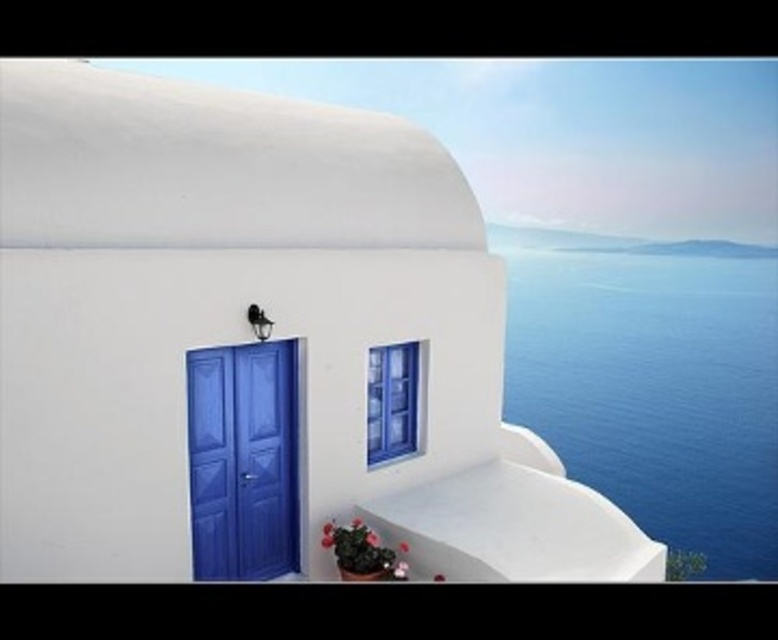
Question: Which object is positioned closest to the blue glass window at center?

Choices:
 (A) blue water at right
 (B) matte blue door at lower left

Answer: (B)

Question: Is blue water at right below blue glass window at center?

Choices:
 (A) no
 (B) yes

Answer: (B)

Question: Can you confirm if blue water at right is positioned to the right of blue glass window at center?

Choices:
 (A) no
 (B) yes

Answer: (B)

Question: Is blue water at right thinner than blue glass window at center?

Choices:
 (A) yes
 (B) no

Answer: (B)

Question: Which of the following is the closest to the observer?

Choices:
 (A) blue water at right
 (B) blue glass window at center

Answer: (B)

Question: Among these objects, which one is nearest to the camera?

Choices:
 (A) blue water at right
 (B) matte blue door at lower left

Answer: (B)